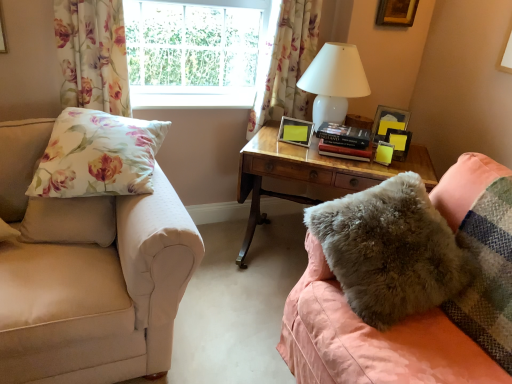
Where is `free space in front of matte wooden picture frame at center, which is the 4th picture frame from right to left`? free space in front of matte wooden picture frame at center, which is the 4th picture frame from right to left is located at coordinates pos(303,152).